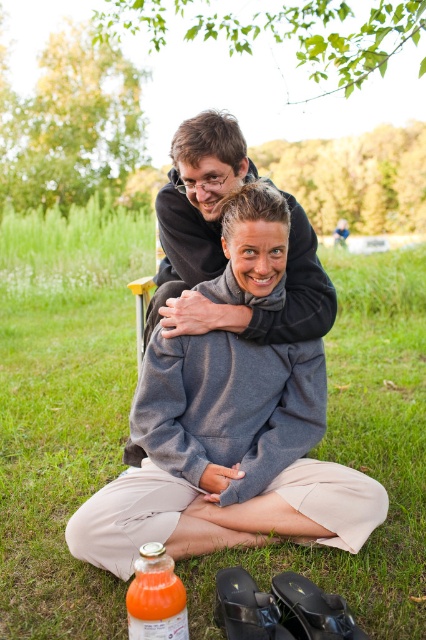
Between translucent orange liquid at lower center and translucent plastic bottle at lower center, which one appears on the right side from the viewer's perspective?

Positioned to the right is translucent orange liquid at lower center.

Does translucent orange liquid at lower center have a smaller size compared to translucent plastic bottle at lower center?

No, translucent orange liquid at lower center is not smaller than translucent plastic bottle at lower center.

Who is more forward, (x=161, y=577) or (x=146, y=589)?

Point (x=146, y=589)

The height and width of the screenshot is (640, 426). Find the location of `translucent orange liquid at lower center`. translucent orange liquid at lower center is located at coordinates (155, 596).

Does point (209, 600) come in front of point (195, 253)?

Yes, point (209, 600) is in front of point (195, 253).

Does point (77, 275) come behind point (207, 138)?

Yes, point (77, 275) is farther from viewer.

What are the coordinates of `green grass at center` in the screenshot? It's located at (63, 410).

Which is more to the left, black soft sweatshirt at center or translucent plastic bottle at lower center?

translucent plastic bottle at lower center

The width and height of the screenshot is (426, 640). Describe the element at coordinates (221, 244) in the screenshot. I see `black soft sweatshirt at center` at that location.

Image resolution: width=426 pixels, height=640 pixels. What do you see at coordinates (221, 244) in the screenshot?
I see `black soft sweatshirt at center` at bounding box center [221, 244].

At what (x,y) coordinates should I click in order to perform the action: click on black soft sweatshirt at center. Please return your answer as a coordinate pair (x, y). This screenshot has height=640, width=426. Looking at the image, I should click on (221, 244).